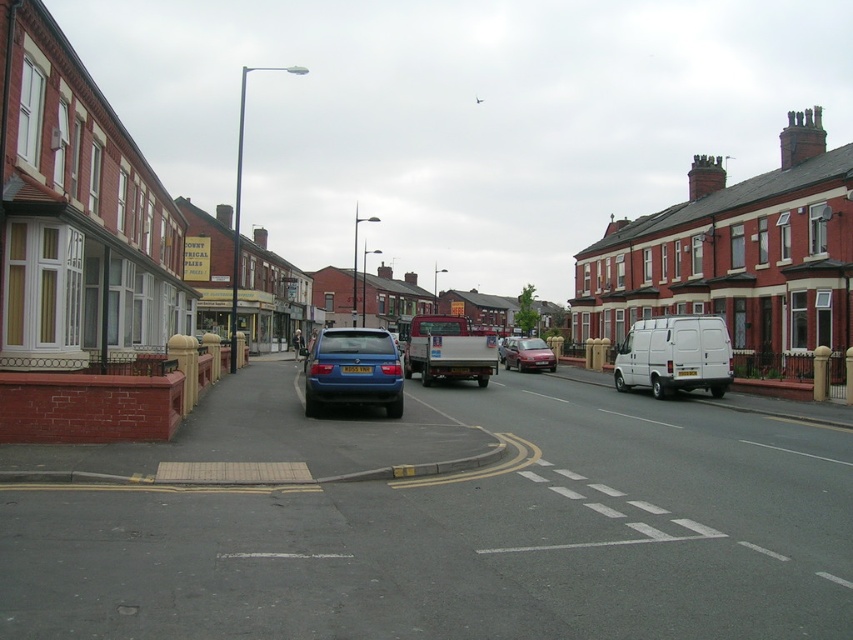
You are a delivery driver who needs to park your 1.8 meters tall delivery van. You see the matte blue hatchback at center and the metallic red sedan at center. Which vehicle can you park next to without blocking the sidewalk?

The metallic red sedan at center is shorter than the matte blue hatchback at center, so parking next to the metallic red sedan at center would allow the delivery van to fit without blocking the sidewalk.

You are a delivery driver who needs to park your vehicle between the matte blue hatchback at center and the metallic red sedan at center. Given that your delivery van is 5 meters long, can you fit it in the space between them?

The space between the matte blue hatchback at center and the metallic red sedan at center is not specified in the provided description. However, since the vehicles are parked on a street with a slight curve and road markings indicating a roundabout or intersection, there might be limited space available. Without exact measurements, it is uncertain if the 5 meter van can fit. Please check the actual space before attempting to park.